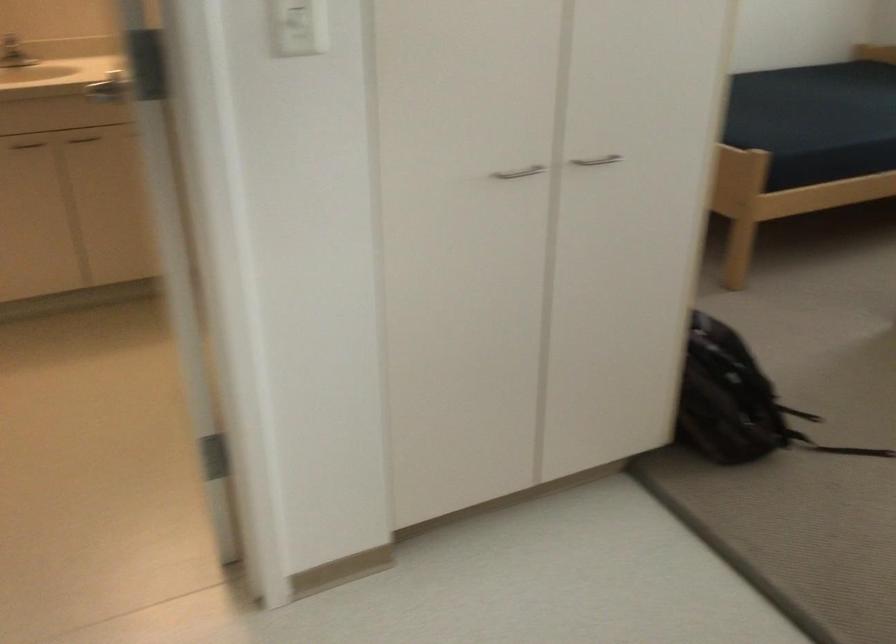
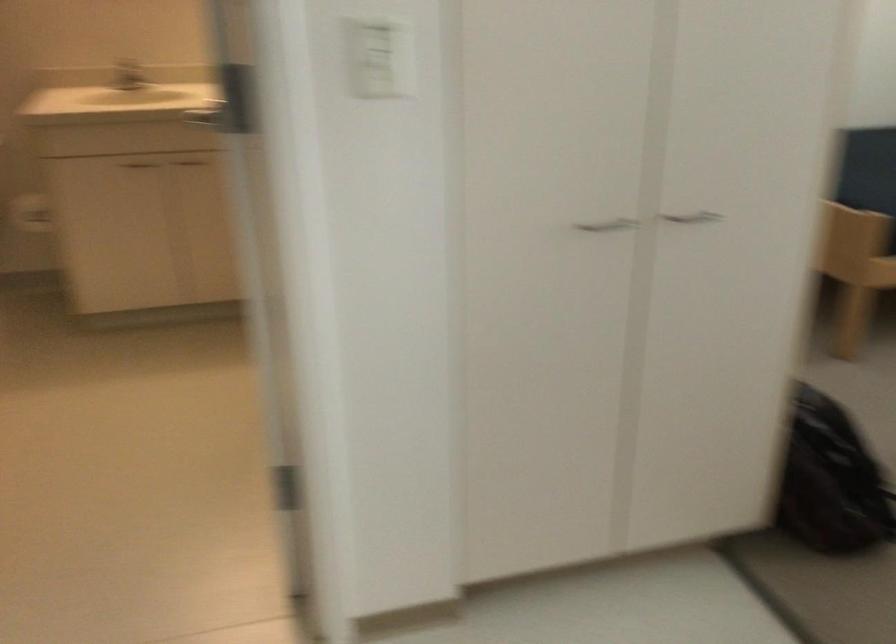
The point at (515, 174) is marked in the first image. Where is the corresponding point in the second image?

(607, 225)